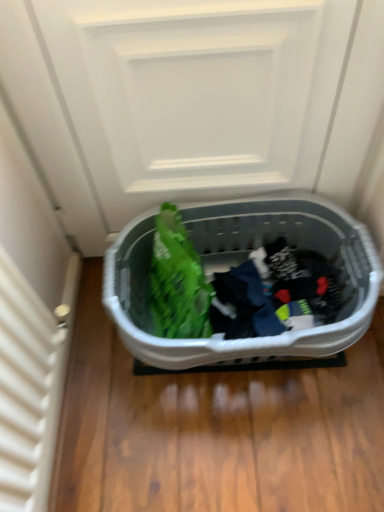
This screenshot has width=384, height=512. In order to click on free spot in front of plastic laundry basket at center in this screenshot , I will do `click(248, 450)`.